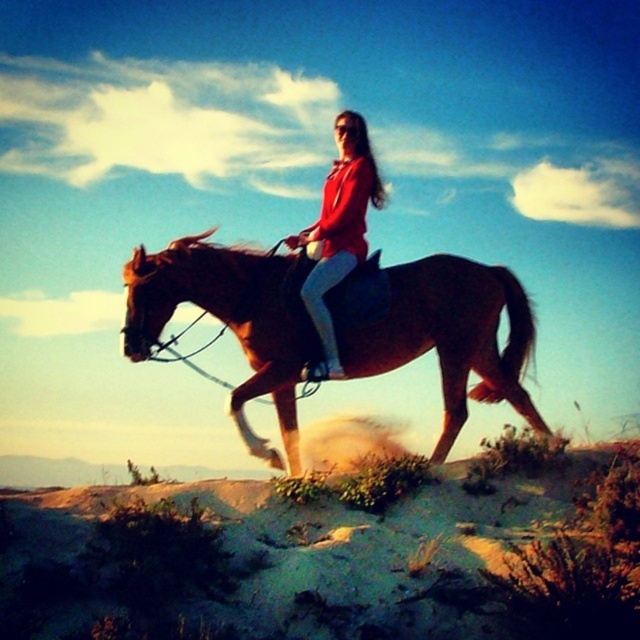
You are standing in the scene and want to move from point (486,388) to point (353,240). Which direction should you face to walk towards the destination?

You should face towards the point (353,240), which is closer to the camera than point (486,388). Since point (353,240) is nearer, you need to walk towards it by facing away from the direction of point (486,388).

You are an observer standing at a distance. You see the brown glossy horse at center and the matte red jacket at center. Which object appears smaller in the scene?

The brown glossy horse at center appears smaller than the matte red jacket at center in the scene.

You are standing in the outdoor scene and want to reach the point marked at coordinates (436, 330). If you can walk 10 meters in one minute, how long will it take you to reach that point?

The distance of point (436, 330) from viewer is 9.14 meters. At a walking speed of 10 meters per minute, it would take approximately 0.914 minutes, which is roughly 55 seconds to reach the point.